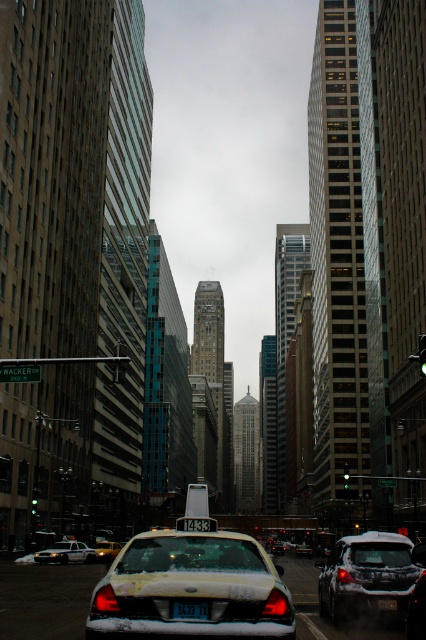
Is yellow matte taxi at center in front of yellow plastic taxi cab at center?

Yes, it is in front of yellow plastic taxi cab at center.

The width and height of the screenshot is (426, 640). Find the location of `yellow matte taxi at center`. yellow matte taxi at center is located at coordinates (106, 548).

This screenshot has width=426, height=640. Find the location of `yellow matte taxi at center`. yellow matte taxi at center is located at coordinates (106, 548).

Which is more to the left, white glossy sedan at lower left or black plastic taxi at center?

white glossy sedan at lower left

Looking at this image, does white glossy sedan at lower left appear under black plastic taxi at center?

Yes.

Where is `white glossy sedan at lower left`? Image resolution: width=426 pixels, height=640 pixels. white glossy sedan at lower left is located at coordinates (66, 552).

Between snow-covered sedan at center and black plastic taxi at center, which one is positioned higher?

black plastic taxi at center is above.

The image size is (426, 640). Identify the location of snow-covered sedan at center. (367, 576).